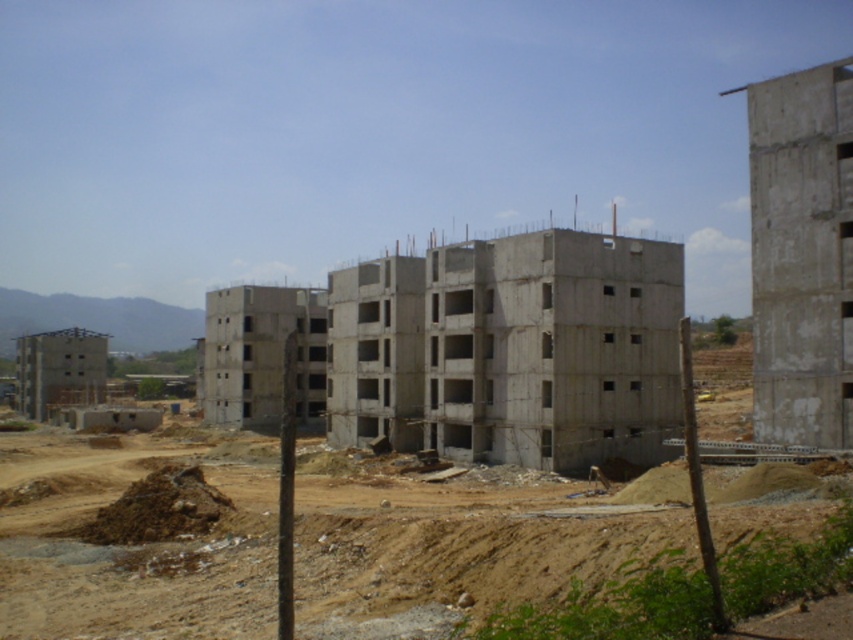
You are a construction worker who needs to transport materials from the brown sandy dirt field at center to the concrete building at center. Which area has a larger width to accommodate the transport path?

The brown sandy dirt field at center might be wider than the concrete building at center, so it could provide a larger space for transporting materials.